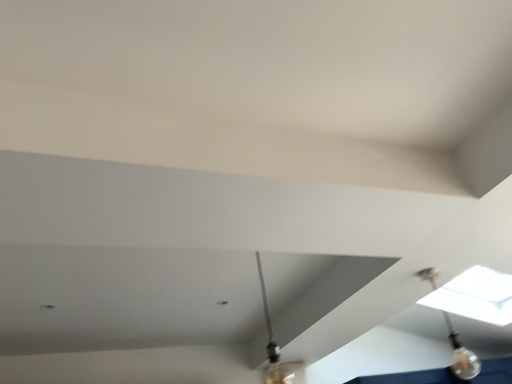
Question: Can we say clear glass bulb at upper right lies outside metallic silver lamp at center?

Choices:
 (A) no
 (B) yes

Answer: (B)

Question: From the image's perspective, is clear glass bulb at upper right on top of metallic silver lamp at center?

Choices:
 (A) yes
 (B) no

Answer: (B)

Question: Is clear glass bulb at upper right beside metallic silver lamp at center?

Choices:
 (A) no
 (B) yes

Answer: (A)

Question: From the image's perspective, is clear glass bulb at upper right located beneath metallic silver lamp at center?

Choices:
 (A) yes
 (B) no

Answer: (A)

Question: Is clear glass bulb at upper right to the left of metallic silver lamp at center from the viewer's perspective?

Choices:
 (A) no
 (B) yes

Answer: (A)

Question: Is clear glass bulb at upper right turned away from metallic silver lamp at center?

Choices:
 (A) yes
 (B) no

Answer: (A)

Question: Considering the relative sizes of metallic silver lamp at center and clear glass bulb at upper right in the image provided, is metallic silver lamp at center wider than clear glass bulb at upper right?

Choices:
 (A) yes
 (B) no

Answer: (A)

Question: From the image's perspective, would you say metallic silver lamp at center is positioned over clear glass bulb at upper right?

Choices:
 (A) no
 (B) yes

Answer: (B)

Question: From a real-world perspective, is metallic silver lamp at center under clear glass bulb at upper right?

Choices:
 (A) yes
 (B) no

Answer: (B)

Question: Does metallic silver lamp at center touch clear glass bulb at upper right?

Choices:
 (A) no
 (B) yes

Answer: (A)

Question: Considering the relative positions of metallic silver lamp at center and clear glass bulb at upper right in the image provided, is metallic silver lamp at center in front of clear glass bulb at upper right?

Choices:
 (A) yes
 (B) no

Answer: (A)

Question: Is metallic silver lamp at center thinner than clear glass bulb at upper right?

Choices:
 (A) no
 (B) yes

Answer: (A)

Question: From the image's perspective, relative to metallic silver lamp at center, is clear glass bulb at upper right above or below?

Choices:
 (A) above
 (B) below

Answer: (B)